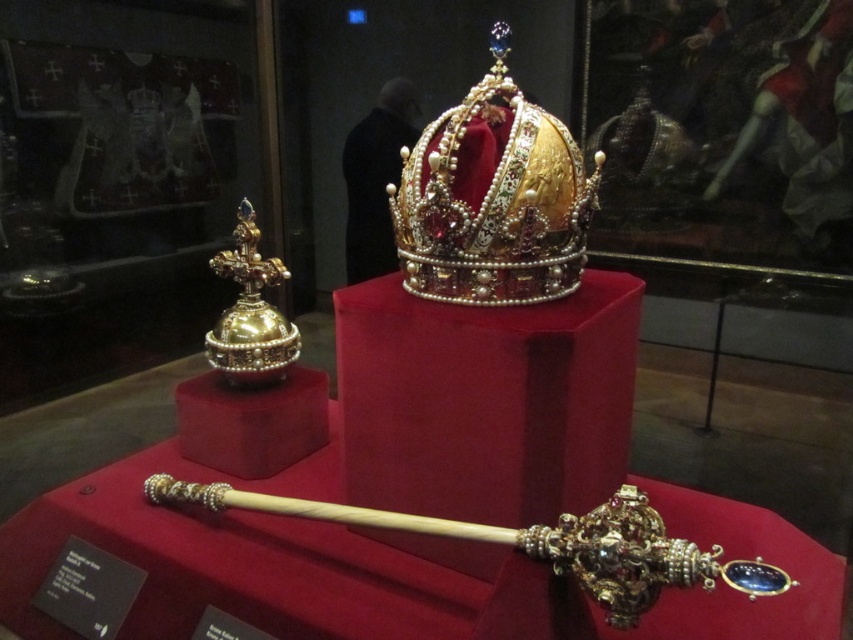
Question: Which object is closer to the camera taking this photo?

Choices:
 (A) gold polished cross at left
 (B) gold jeweled crown at center

Answer: (B)

Question: Is gold jeweled crown at center to the right of gold polished cross at left from the viewer's perspective?

Choices:
 (A) yes
 (B) no

Answer: (A)

Question: Which point is closer to the camera?

Choices:
 (A) gold jeweled crown at center
 (B) gold polished cross at left

Answer: (A)

Question: Is gold jeweled crown at center to the right of gold polished cross at left from the viewer's perspective?

Choices:
 (A) yes
 (B) no

Answer: (A)

Question: Does gold jeweled crown at center have a lesser width compared to gold polished cross at left?

Choices:
 (A) yes
 (B) no

Answer: (B)